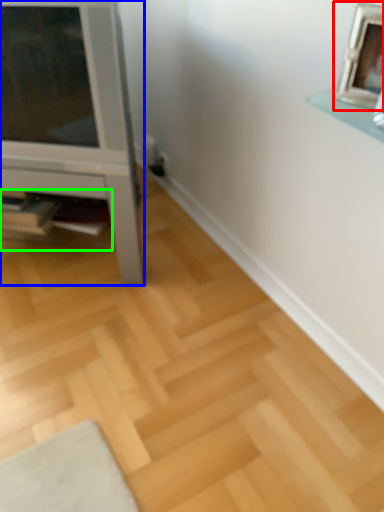
Question: Which object is positioned farthest from picture frame (highlighted by a red box)? Select from furniture (highlighted by a blue box) and shelf (highlighted by a green box).

Choices:
 (A) furniture
 (B) shelf

Answer: (B)